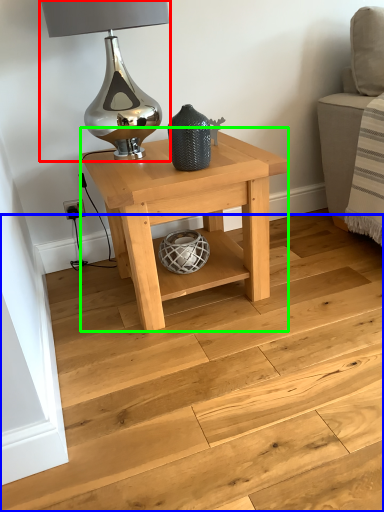
Question: Which object is positioned closest to table lamp (highlighted by a red box)? Select from stairwell (highlighted by a blue box) and table (highlighted by a green box).

Choices:
 (A) stairwell
 (B) table

Answer: (B)